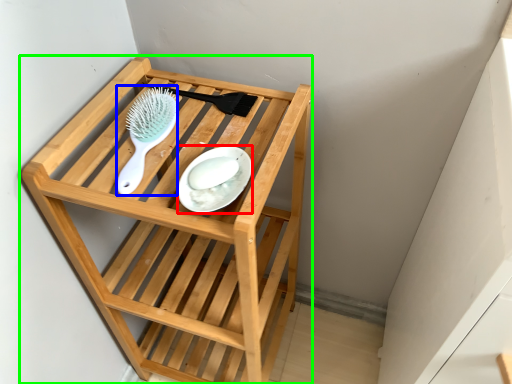
Question: Which object is the closest to the plate (highlighted by a red box)? Choose among these: brush (highlighted by a blue box) or furniture (highlighted by a green box).

Choices:
 (A) brush
 (B) furniture

Answer: (A)